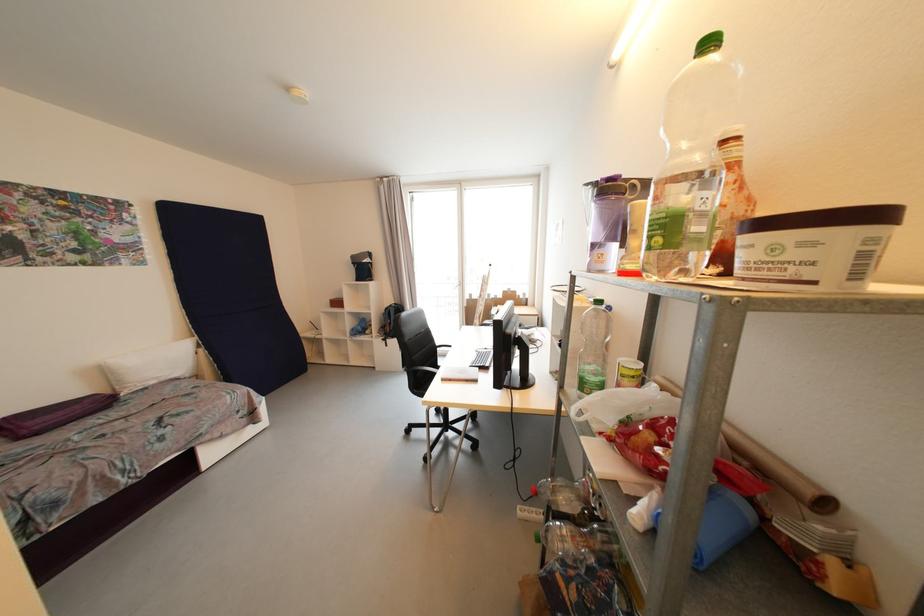
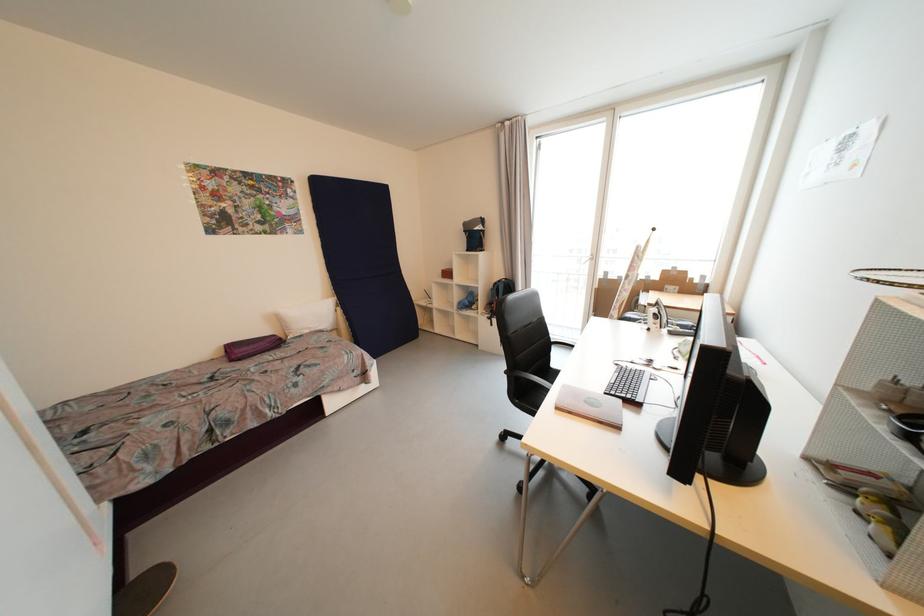
Where in the second image is the point corresponding to [392,310] from the first image?

(501, 285)